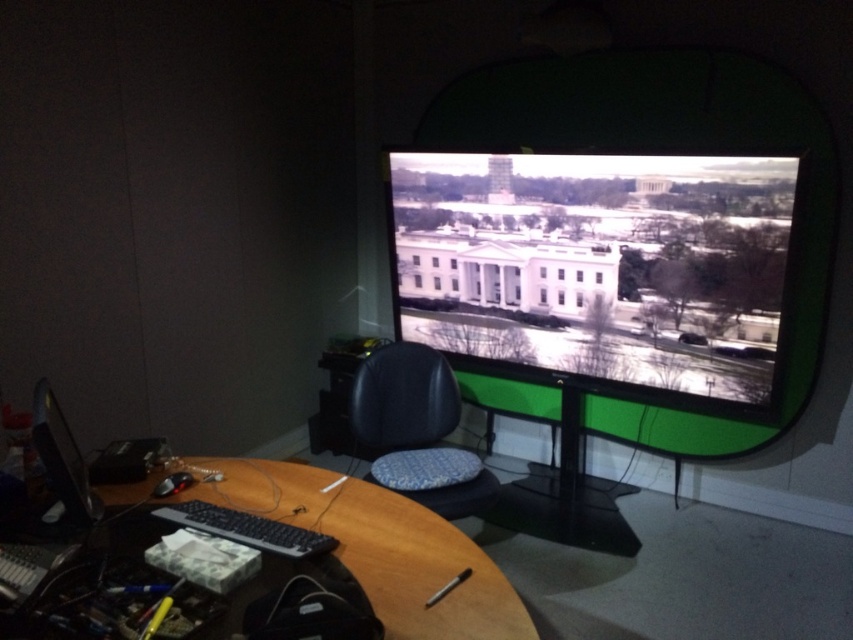
Does wooden at center lie behind matte black monitor at lower left?

No, it is in front of matte black monitor at lower left.

Which is more to the left, wooden at center or matte black monitor at lower left?

Positioned to the left is matte black monitor at lower left.

Between point (467, 625) and point (51, 396), which one is positioned behind?

Positioned behind is point (51, 396).

Find the location of `wooden at center`. wooden at center is located at coordinates (379, 547).

Is wooden at center to the right of black leather chair at center from the viewer's perspective?

Incorrect, wooden at center is not on the right side of black leather chair at center.

The height and width of the screenshot is (640, 853). Find the location of `wooden at center`. wooden at center is located at coordinates (379, 547).

Does black leather chair at center appear over matte black monitor at lower left?

Incorrect, black leather chair at center is not positioned above matte black monitor at lower left.

Looking at this image, is black leather chair at center smaller than matte black monitor at lower left?

No.

Is point (387, 380) positioned in front of point (97, 516)?

No, it is not.

Where is `black leather chair at center`? The width and height of the screenshot is (853, 640). black leather chair at center is located at coordinates (416, 429).